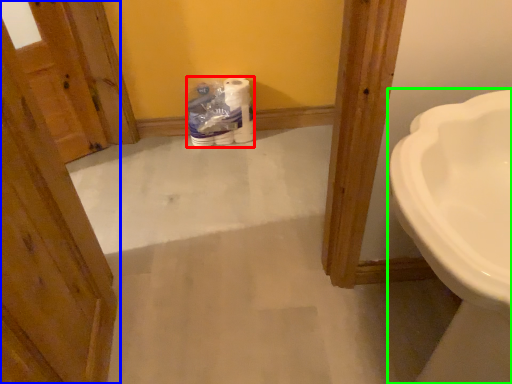
Question: Which object is the farthest from toilet paper (highlighted by a red box)? Choose among these: door (highlighted by a blue box) or sink (highlighted by a green box).

Choices:
 (A) door
 (B) sink

Answer: (B)